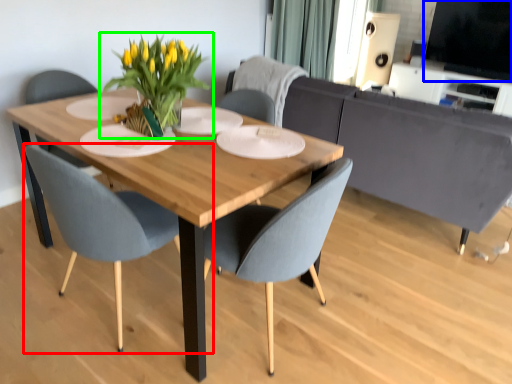
Question: Which object is positioned farthest from chair (highlighted by a red box)? Select from window screen (highlighted by a blue box) and houseplant (highlighted by a green box).

Choices:
 (A) window screen
 (B) houseplant

Answer: (A)